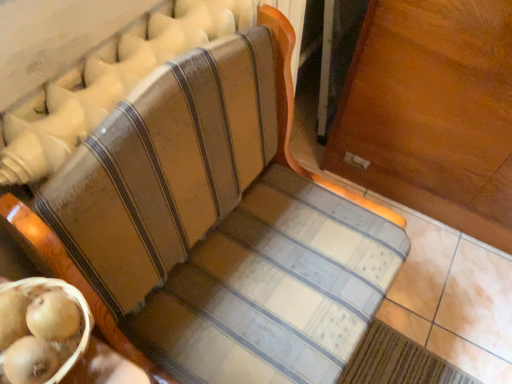
Question: Is smooth golden kiwi at lower left facing away from wooden textured basket at lower left?

Choices:
 (A) yes
 (B) no

Answer: (A)

Question: Are smooth golden kiwi at lower left and wooden textured basket at lower left far apart?

Choices:
 (A) yes
 (B) no

Answer: (B)

Question: Does smooth golden kiwi at lower left lie behind wooden textured basket at lower left?

Choices:
 (A) yes
 (B) no

Answer: (A)

Question: Can you confirm if smooth golden kiwi at lower left is positioned to the left of wooden textured basket at lower left?

Choices:
 (A) no
 (B) yes

Answer: (A)

Question: From the image's perspective, would you say smooth golden kiwi at lower left is shown under wooden textured basket at lower left?

Choices:
 (A) yes
 (B) no

Answer: (B)

Question: Does smooth golden kiwi at lower left turn towards wooden textured basket at lower left?

Choices:
 (A) yes
 (B) no

Answer: (A)

Question: Would you say wooden textured basket at lower left is outside smooth golden kiwi at lower left?

Choices:
 (A) no
 (B) yes

Answer: (B)

Question: From a real-world perspective, is wooden textured basket at lower left physically above smooth golden kiwi at lower left?

Choices:
 (A) no
 (B) yes

Answer: (A)

Question: Is wooden textured basket at lower left facing towards smooth golden kiwi at lower left?

Choices:
 (A) no
 (B) yes

Answer: (A)

Question: From the image's perspective, is wooden textured basket at lower left located beneath smooth golden kiwi at lower left?

Choices:
 (A) no
 (B) yes

Answer: (B)

Question: Does wooden textured basket at lower left appear on the right side of smooth golden kiwi at lower left?

Choices:
 (A) no
 (B) yes

Answer: (A)

Question: Can you confirm if wooden textured basket at lower left is taller than smooth golden kiwi at lower left?

Choices:
 (A) no
 (B) yes

Answer: (B)

Question: Considering the positions of smooth golden kiwi at lower left and wooden textured basket at lower left in the image, is smooth golden kiwi at lower left wider or thinner than wooden textured basket at lower left?

Choices:
 (A) thin
 (B) wide

Answer: (A)